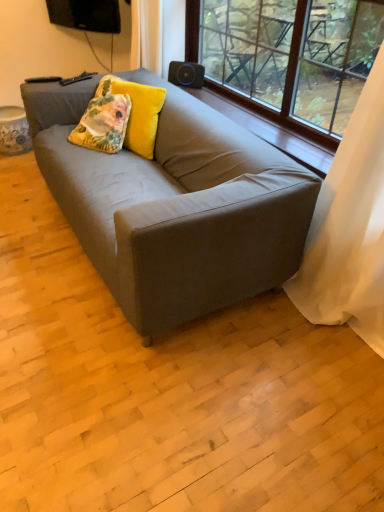
Question: Does white sheer curtain at right lie behind wooden at upper center?

Choices:
 (A) no
 (B) yes

Answer: (A)

Question: Is white sheer curtain at right bigger than wooden at upper center?

Choices:
 (A) no
 (B) yes

Answer: (B)

Question: Can you confirm if white sheer curtain at right is taller than wooden at upper center?

Choices:
 (A) yes
 (B) no

Answer: (A)

Question: Is white sheer curtain at right at the right side of wooden at upper center?

Choices:
 (A) no
 (B) yes

Answer: (B)

Question: From a real-world perspective, is white sheer curtain at right physically above wooden at upper center?

Choices:
 (A) no
 (B) yes

Answer: (B)

Question: Does white sheer curtain at right have a smaller size compared to wooden at upper center?

Choices:
 (A) no
 (B) yes

Answer: (A)

Question: Considering the relative positions of floral-patterned velvet pillow at center and transparent glass window at upper center in the image provided, is floral-patterned velvet pillow at center to the left of transparent glass window at upper center from the viewer's perspective?

Choices:
 (A) no
 (B) yes

Answer: (B)

Question: From the image's perspective, is floral-patterned velvet pillow at center located above transparent glass window at upper center?

Choices:
 (A) yes
 (B) no

Answer: (B)

Question: Does floral-patterned velvet pillow at center have a lesser width compared to transparent glass window at upper center?

Choices:
 (A) no
 (B) yes

Answer: (A)

Question: Considering the relative positions of floral-patterned velvet pillow at center and transparent glass window at upper center in the image provided, is floral-patterned velvet pillow at center behind transparent glass window at upper center?

Choices:
 (A) yes
 (B) no

Answer: (A)

Question: Is floral-patterned velvet pillow at center facing towards transparent glass window at upper center?

Choices:
 (A) yes
 (B) no

Answer: (B)

Question: Is floral-patterned velvet pillow at center to the right of transparent glass window at upper center from the viewer's perspective?

Choices:
 (A) no
 (B) yes

Answer: (A)

Question: Considering the relative sizes of white sheer curtain at right and floral-patterned velvet pillow at upper left in the image provided, is white sheer curtain at right thinner than floral-patterned velvet pillow at upper left?

Choices:
 (A) no
 (B) yes

Answer: (B)